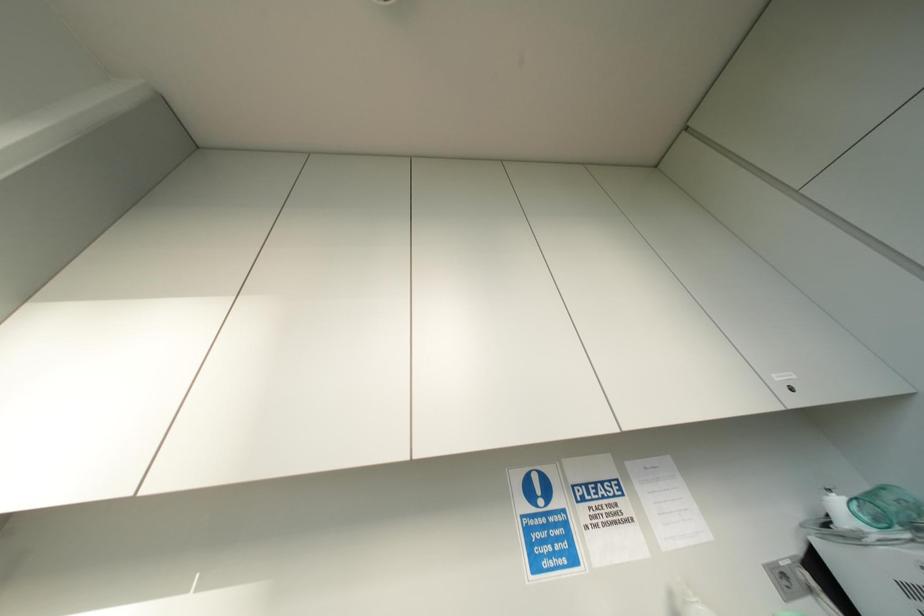
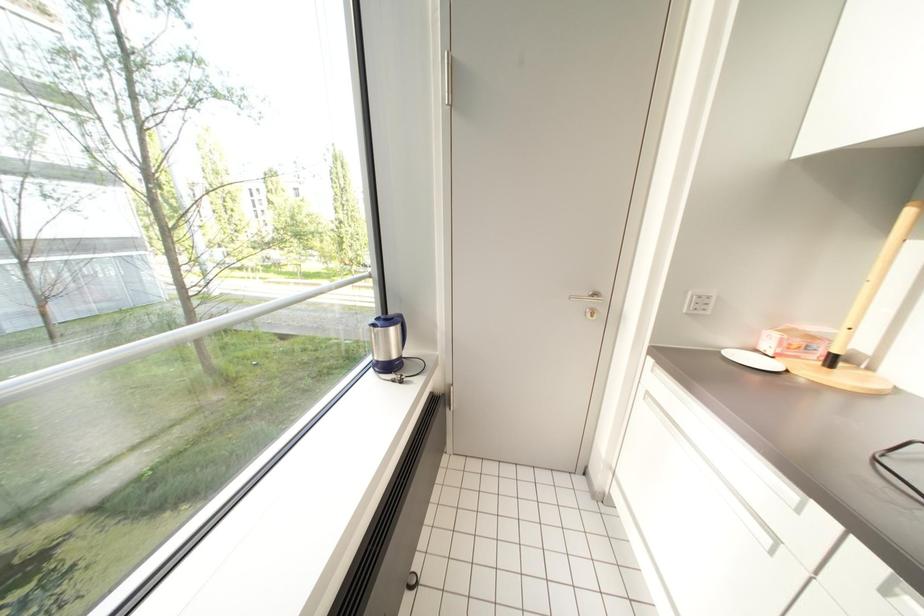
Question: Based on the continuous images, in which direction is the camera rotating? Reply with the corresponding letter.

Choices:
 (A) Left
 (B) Right
 (C) Up
 (D) Down

Answer: (A)